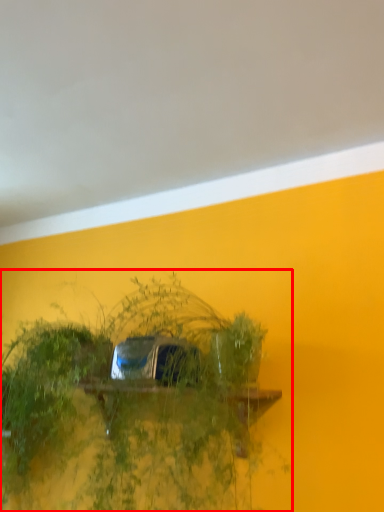
Question: Considering the relative positions of houseplant (annotated by the red box) and backdrop in the image provided, where is houseplant (annotated by the red box) located with respect to the staircase?

Choices:
 (A) right
 (B) left

Answer: (A)